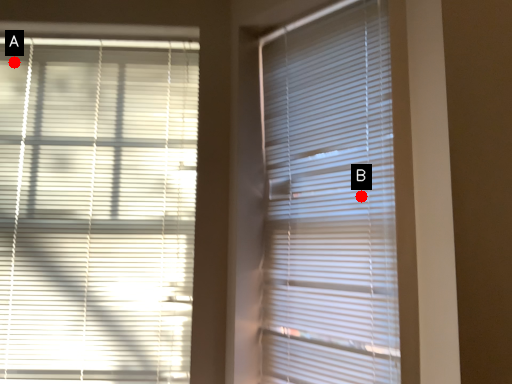
Question: Two points are circled on the image, labeled by A and B beside each circle. Which point is closer to the camera?

Choices:
 (A) A is closer
 (B) B is closer

Answer: (B)